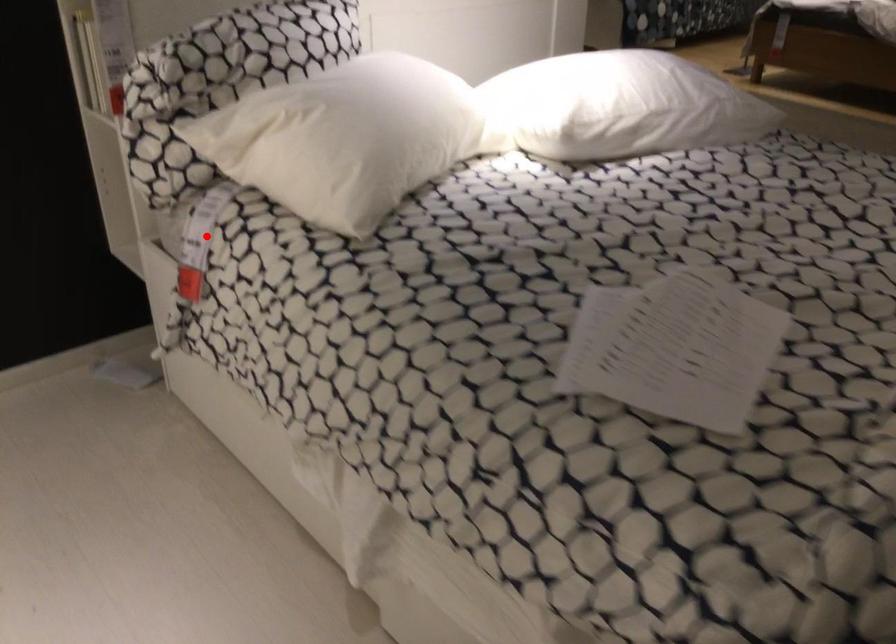
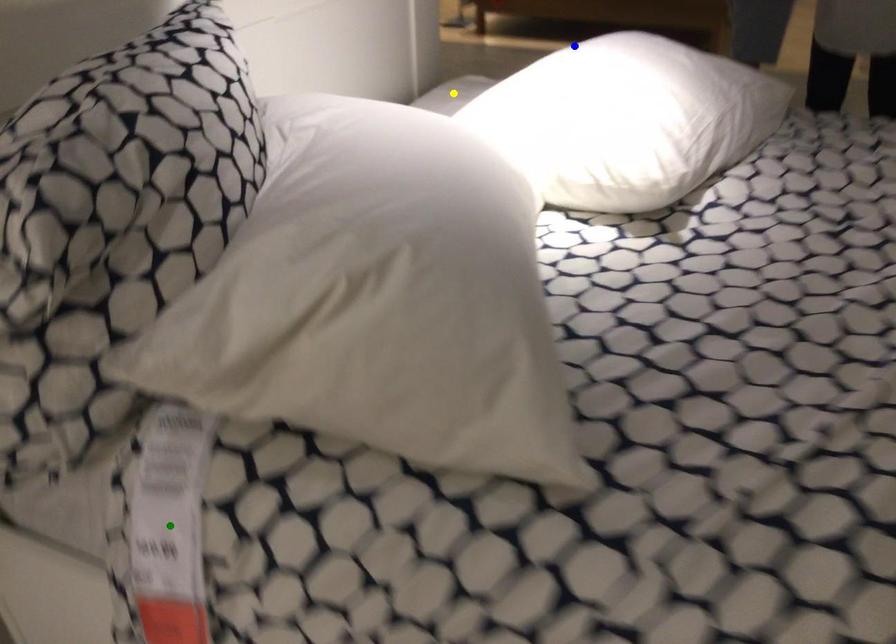
Question: I am providing you with two images of the same scene from different viewpoints. A red point is marked on the first image. You are given multiple points on the second image. Which point in image 2 is actually the same real-world point as the red point in image 1?

Choices:
 (A) blue point
 (B) yellow point
 (C) green point

Answer: (C)